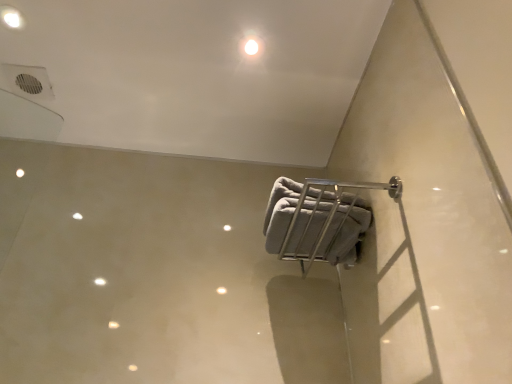
From the picture: In order to face white glossy light fixture at upper left, the 2th dot positioned from the bottom, should I rotate leftwards or rightwards?

Turn left approximately 30.044 degrees to face it.

Where is `white glossy light fixture at upper left, the 2th dot positioned from the bottom`? This screenshot has height=384, width=512. white glossy light fixture at upper left, the 2th dot positioned from the bottom is located at coordinates (11, 17).

The height and width of the screenshot is (384, 512). What do you see at coordinates (345, 231) in the screenshot?
I see `gray fabric towel at center-right` at bounding box center [345, 231].

Image resolution: width=512 pixels, height=384 pixels. In order to click on white glossy light fixture at upper left, the 1th dot in the left-to-right sequence in this screenshot , I will do `click(11, 17)`.

Between gray fabric towel at center-right and white glossy light at upper center, which is the second dot in top-to-bottom order, which one is positioned behind?

white glossy light at upper center, which is the second dot in top-to-bottom order, is further from the camera.

From a real-world perspective, does gray fabric towel at center-right sit lower than white glossy light at upper center, which appears as the 1th dot when ordered from the bottom?

Yes, from a real-world perspective, gray fabric towel at center-right is under white glossy light at upper center, which appears as the 1th dot when ordered from the bottom.

From the image's perspective, which is above, gray fabric towel at center-right or white glossy light at upper center, the 2th dot from the left?

From the image's view, white glossy light at upper center, the 2th dot from the left, is above.

Can you confirm if gray fabric towel at center-right is positioned to the left of white glossy light at upper center, which appears as the 1th dot when ordered from the bottom?

No, gray fabric towel at center-right is not to the left of white glossy light at upper center, which appears as the 1th dot when ordered from the bottom.

Does white glossy light at upper center, the 2th dot from the left, lie in front of gray fabric towel at center-right?

No, white glossy light at upper center, the 2th dot from the left, is behind gray fabric towel at center-right.

In terms of width, does white glossy light at upper center, which is the second dot in top-to-bottom order, look wider or thinner when compared to gray fabric towel at center-right?

In the image, white glossy light at upper center, which is the second dot in top-to-bottom order, appears to be more narrow than gray fabric towel at center-right.

Consider the image. From the image's perspective, would you say white glossy light at upper center, which appears as the first dot when viewed from the right, is shown under gray fabric towel at center-right?

No, from the image's perspective, white glossy light at upper center, which appears as the first dot when viewed from the right, is not below gray fabric towel at center-right.

Can you tell me how much white glossy light at upper center, which is the second dot in top-to-bottom order, and gray fabric towel at center-right differ in facing direction?

0.821 degrees.

Consider the image. Is white glossy light fixture at upper left, the second dot in the right-to-left sequence, beside gray fabric towel at center-right?

No.

From the picture: From the image's perspective, is white glossy light fixture at upper left, which is the first dot from top to bottom, positioned above or below gray fabric towel at center-right?

From the image's perspective, white glossy light fixture at upper left, which is the first dot from top to bottom, appears above gray fabric towel at center-right.

Does white glossy light fixture at upper left, which is the first dot from top to bottom, appear on the left side of gray fabric towel at center-right?

Correct, you'll find white glossy light fixture at upper left, which is the first dot from top to bottom, to the left of gray fabric towel at center-right.

Considering the relative positions of white glossy light at upper center, the 2th dot from the left, and white glossy light fixture at upper left, which is the first dot from top to bottom, in the image provided, is white glossy light at upper center, the 2th dot from the left, to the right of white glossy light fixture at upper left, which is the first dot from top to bottom, from the viewer's perspective?

Yes, white glossy light at upper center, the 2th dot from the left, is to the right of white glossy light fixture at upper left, which is the first dot from top to bottom.

From the image's perspective, which object appears higher, white glossy light at upper center, which is the second dot in top-to-bottom order, or white glossy light fixture at upper left, the 2th dot positioned from the bottom?

From the image's view, white glossy light fixture at upper left, the 2th dot positioned from the bottom, is above.

Is point (247, 46) farther from viewer compared to point (16, 20)?

Yes, it is.

Based on the photo, is white glossy light at upper center, which appears as the first dot when viewed from the right, spatially inside white glossy light fixture at upper left, the 2th dot positioned from the bottom, or outside of it?

white glossy light at upper center, which appears as the first dot when viewed from the right, is spatially situated outside white glossy light fixture at upper left, the 2th dot positioned from the bottom.

Is white glossy light fixture at upper left, the 1th dot in the left-to-right sequence, taller or shorter than white glossy light at upper center, which appears as the first dot when viewed from the right?

Considering their sizes, white glossy light fixture at upper left, the 1th dot in the left-to-right sequence, has less height than white glossy light at upper center, which appears as the first dot when viewed from the right.

Is white glossy light fixture at upper left, which is the first dot from top to bottom, completely or partially outside of white glossy light at upper center, which is the second dot in top-to-bottom order?

white glossy light fixture at upper left, which is the first dot from top to bottom, is positioned outside white glossy light at upper center, which is the second dot in top-to-bottom order.

What's the angular difference between white glossy light fixture at upper left, which is the first dot from top to bottom, and white glossy light at upper center, which is the second dot in top-to-bottom order,'s facing directions?

The facing directions of white glossy light fixture at upper left, which is the first dot from top to bottom, and white glossy light at upper center, which is the second dot in top-to-bottom order, are 179 degrees apart.

Is white glossy light fixture at upper left, the 1th dot in the left-to-right sequence, in front of or behind white glossy light at upper center, which is the second dot in top-to-bottom order, in the image?

white glossy light fixture at upper left, the 1th dot in the left-to-right sequence, is in front of white glossy light at upper center, which is the second dot in top-to-bottom order.

Would you say gray fabric towel at center-right is inside or outside white glossy light fixture at upper left, the 2th dot positioned from the bottom?

gray fabric towel at center-right exists outside the volume of white glossy light fixture at upper left, the 2th dot positioned from the bottom.

Between gray fabric towel at center-right and white glossy light fixture at upper left, which is the first dot from top to bottom, which one has larger size?

With larger size is gray fabric towel at center-right.

Consider the image. Is gray fabric towel at center-right to the left of white glossy light fixture at upper left, which is the first dot from top to bottom, from the viewer's perspective?

In fact, gray fabric towel at center-right is to the right of white glossy light fixture at upper left, which is the first dot from top to bottom.

Locate an element on the screen. The width and height of the screenshot is (512, 384). dot that is the 1st one when counting leftward from the gray fabric towel at center-right is located at coordinates (251, 46).

At what (x,y) coordinates should I click in order to perform the action: click on towel that appears on the right of white glossy light at upper center, which appears as the 1th dot when ordered from the bottom. Please return your answer as a coordinate pair (x, y). The image size is (512, 384). Looking at the image, I should click on (345, 231).

When comparing their distances from white glossy light at upper center, which is the second dot in top-to-bottom order, does white glossy light fixture at upper left, the 1th dot in the left-to-right sequence, or gray fabric towel at center-right seem further?

Among the two, white glossy light fixture at upper left, the 1th dot in the left-to-right sequence, is located further to white glossy light at upper center, which is the second dot in top-to-bottom order.

From the image, which object appears to be farther from white glossy light at upper center, the 2th dot from the left, gray fabric towel at center-right or white glossy light fixture at upper left, the 1th dot in the left-to-right sequence?

white glossy light fixture at upper left, the 1th dot in the left-to-right sequence, is further to white glossy light at upper center, the 2th dot from the left.

Estimate the real-world distances between objects in this image. Which object is further from gray fabric towel at center-right, white glossy light at upper center, which appears as the 1th dot when ordered from the bottom, or white glossy light fixture at upper left, the 2th dot positioned from the bottom?

The object further to gray fabric towel at center-right is white glossy light fixture at upper left, the 2th dot positioned from the bottom.

Estimate the real-world distances between objects in this image. Which object is further from white glossy light fixture at upper left, which is the first dot from top to bottom, gray fabric towel at center-right or white glossy light at upper center, which appears as the 1th dot when ordered from the bottom?

gray fabric towel at center-right is positioned further to the anchor white glossy light fixture at upper left, which is the first dot from top to bottom.

Based on their spatial positions, is white glossy light fixture at upper left, the second dot in the right-to-left sequence, or white glossy light at upper center, the 2th dot from the left, closer to gray fabric towel at center-right?

white glossy light at upper center, the 2th dot from the left.

Looking at the image, which one is located further to white glossy light fixture at upper left, the second dot in the right-to-left sequence, white glossy light at upper center, which is the second dot in top-to-bottom order, or gray fabric towel at center-right?

The object further to white glossy light fixture at upper left, the second dot in the right-to-left sequence, is gray fabric towel at center-right.

Locate an element on the screen. This screenshot has width=512, height=384. dot between white glossy light fixture at upper left, the 1th dot in the left-to-right sequence, and gray fabric towel at center-right, in the horizontal direction is located at coordinates (251, 46).